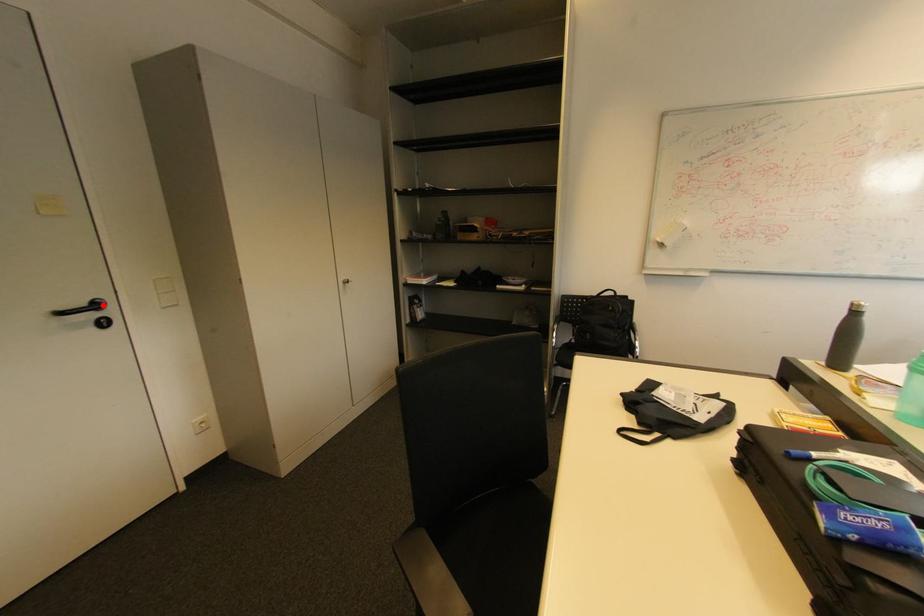
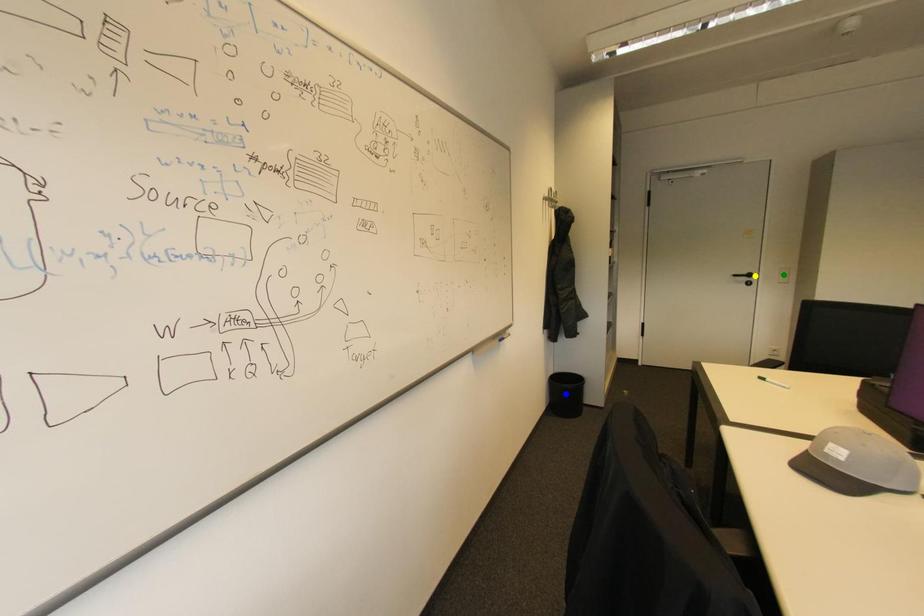
Question: I am providing you with two images of the same scene from different viewpoints. A red point is marked on the first image. You are given multiple points on the second image. In image 2, which mark is for the same physical point as the one in image 1?

Choices:
 (A) blue point
 (B) green point
 (C) yellow point

Answer: (C)